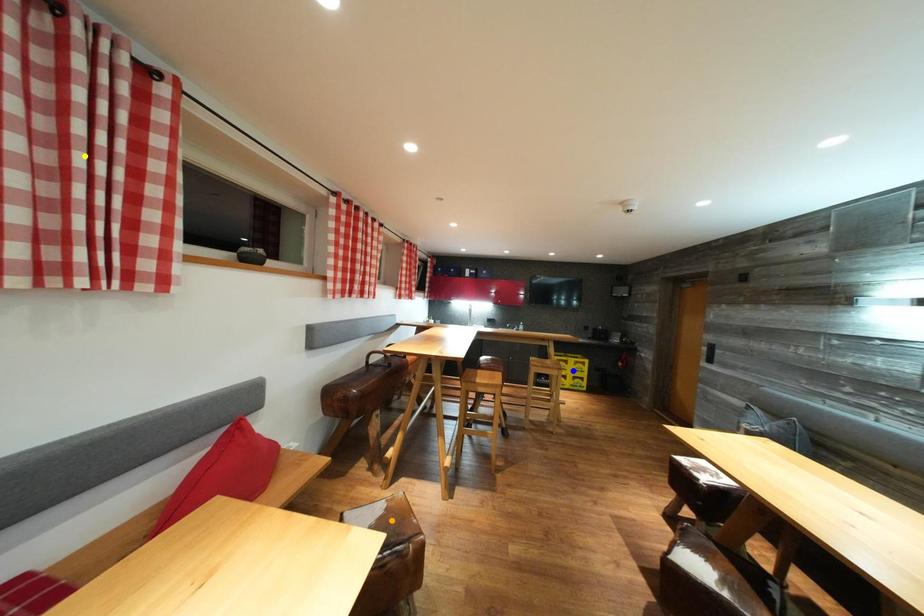
Order these from nearest to farthest:
- orange point
- blue point
- yellow point

yellow point < orange point < blue point